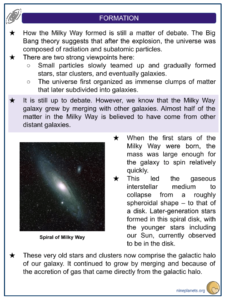
Identify the location of white light. This screenshot has width=225, height=300. (61, 185).